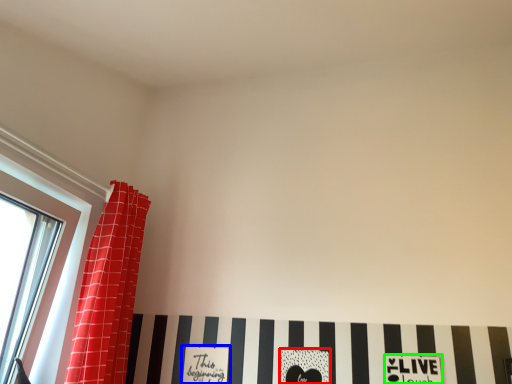
Question: Which object is positioned closest to print (highlighted by a red box)? Select from print (highlighted by a blue box) and print (highlighted by a green box).

Choices:
 (A) print
 (B) print

Answer: (B)